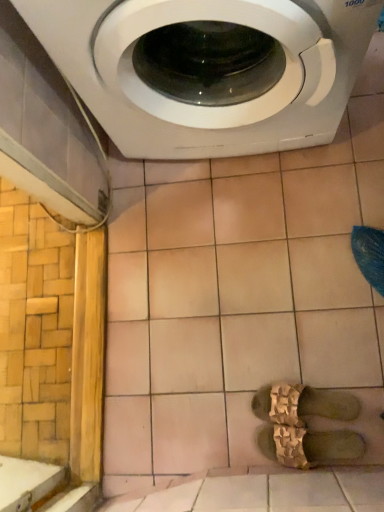
Describe the element at coordinates (236, 295) in the screenshot. This screenshot has height=512, width=384. I see `beige ceramic tile at upper center` at that location.

What do you see at coordinates (205, 71) in the screenshot? I see `white glossy washing machine at upper center` at bounding box center [205, 71].

Where is `brown textured sandals at center, acting as the first shoe starting from the bottom`? brown textured sandals at center, acting as the first shoe starting from the bottom is located at coordinates (308, 446).

Locate an element on the screen. The height and width of the screenshot is (512, 384). beige ceramic tile at upper center is located at coordinates (236, 295).

Considering the relative sizes of beige ceramic tile at upper center and white glossy washing machine at upper center in the image provided, is beige ceramic tile at upper center wider than white glossy washing machine at upper center?

Indeed, beige ceramic tile at upper center has a greater width compared to white glossy washing machine at upper center.

Image resolution: width=384 pixels, height=512 pixels. What are the coordinates of `ceramic tile located underneath the white glossy washing machine at upper center (from a real-world perspective)` in the screenshot? It's located at (236, 295).

Are beige ceramic tile at upper center and white glossy washing machine at upper center making contact?

beige ceramic tile at upper center and white glossy washing machine at upper center are not in contact.

Is beige ceramic tile at upper center located outside white glossy washing machine at upper center?

Indeed, beige ceramic tile at upper center is completely outside white glossy washing machine at upper center.

Can you confirm if gold textured sandals at center, the first shoe when ordered from top to bottom, is smaller than brown textured sandals at center, acting as the first shoe starting from the bottom?

Correct, gold textured sandals at center, the first shoe when ordered from top to bottom, occupies less space than brown textured sandals at center, acting as the first shoe starting from the bottom.

Where is `shoe located on the left of gold textured sandals at center, the first shoe when ordered from top to bottom`? shoe located on the left of gold textured sandals at center, the first shoe when ordered from top to bottom is located at coordinates (308, 446).

Considering the positions of objects gold textured sandals at center, the first shoe when ordered from top to bottom, and brown textured sandals at center, acting as the first shoe starting from the bottom, in the image provided, who is more to the right, gold textured sandals at center, the first shoe when ordered from top to bottom, or brown textured sandals at center, acting as the first shoe starting from the bottom,?

Positioned to the right is gold textured sandals at center, the first shoe when ordered from top to bottom.

Starting from the white glossy washing machine at upper center, which shoe is the 1st one to the right? Please provide its 2D coordinates.

[(308, 446)]

Does white glossy washing machine at upper center appear on the left side of brown textured sandals at center, which is the 2th shoe in top-to-bottom order?

Correct, you'll find white glossy washing machine at upper center to the left of brown textured sandals at center, which is the 2th shoe in top-to-bottom order.

Is white glossy washing machine at upper center far away from brown textured sandals at center, which is the 2th shoe in top-to-bottom order?

white glossy washing machine at upper center is near brown textured sandals at center, which is the 2th shoe in top-to-bottom order, not far away.

Does point (361, 51) appear closer or farther from the camera than point (332, 450)?

Point (361, 51).

Is brown textured sandals at center, which is the 2th shoe in top-to-bottom order, completely or partially inside beige ceramic tile at upper center?

No.

Which shoe is the 1st one when counting from the right side of the beige ceramic tile at upper center? Please provide its 2D coordinates.

[(308, 446)]

Relative to brown textured sandals at center, which is the 2th shoe in top-to-bottom order, is beige ceramic tile at upper center in front or behind?

beige ceramic tile at upper center is behind brown textured sandals at center, which is the 2th shoe in top-to-bottom order.

Is white glossy washing machine at upper center oriented towards gold textured sandals at center, which appears as the 2th shoe when ordered from the bottom?

Yes, white glossy washing machine at upper center is facing gold textured sandals at center, which appears as the 2th shoe when ordered from the bottom.

Considering the positions of points (293, 62) and (291, 403), is point (293, 62) closer to camera compared to point (291, 403)?

Yes, it is.

Between white glossy washing machine at upper center and gold textured sandals at center, the first shoe when ordered from top to bottom, which one is positioned behind?

Positioned behind is gold textured sandals at center, the first shoe when ordered from top to bottom.

Is white glossy washing machine at upper center at the right side of gold textured sandals at center, the first shoe when ordered from top to bottom?

In fact, white glossy washing machine at upper center is to the left of gold textured sandals at center, the first shoe when ordered from top to bottom.

Can we say brown textured sandals at center, which is the 2th shoe in top-to-bottom order, lies outside white glossy washing machine at upper center?

Yes, brown textured sandals at center, which is the 2th shoe in top-to-bottom order, is outside of white glossy washing machine at upper center.

Is brown textured sandals at center, acting as the first shoe starting from the bottom, wider than white glossy washing machine at upper center?

Incorrect, the width of brown textured sandals at center, acting as the first shoe starting from the bottom, does not surpass that of white glossy washing machine at upper center.

Is brown textured sandals at center, acting as the first shoe starting from the bottom, far from white glossy washing machine at upper center?

No, brown textured sandals at center, acting as the first shoe starting from the bottom, is not far from white glossy washing machine at upper center.

From a real-world perspective, which is physically below, brown textured sandals at center, acting as the first shoe starting from the bottom, or white glossy washing machine at upper center?

brown textured sandals at center, acting as the first shoe starting from the bottom.

Is white glossy washing machine at upper center positioned with its back to beige ceramic tile at upper center?

No, white glossy washing machine at upper center is not facing the opposite direction of beige ceramic tile at upper center.

The image size is (384, 512). What are the coordinates of `washing machine that appears above the beige ceramic tile at upper center (from a real-world perspective)` in the screenshot? It's located at (205, 71).

Is point (162, 86) behind point (348, 241)?

That is False.

What are the coordinates of `ceramic tile that is on the right side of white glossy washing machine at upper center` in the screenshot? It's located at (236, 295).

This screenshot has width=384, height=512. Identify the location of shoe in front of the gold textured sandals at center, the first shoe when ordered from top to bottom. (308, 446).

Based on their spatial positions, is beige ceramic tile at upper center or gold textured sandals at center, the first shoe when ordered from top to bottom, closer to brown textured sandals at center, acting as the first shoe starting from the bottom?

gold textured sandals at center, the first shoe when ordered from top to bottom.

Which object lies further to the anchor point white glossy washing machine at upper center, beige ceramic tile at upper center or brown textured sandals at center, acting as the first shoe starting from the bottom?

brown textured sandals at center, acting as the first shoe starting from the bottom.

Looking at the image, which one is located closer to white glossy washing machine at upper center, gold textured sandals at center, which appears as the 2th shoe when ordered from the bottom, or beige ceramic tile at upper center?

The object closer to white glossy washing machine at upper center is beige ceramic tile at upper center.

Looking at this image, when comparing their distances from beige ceramic tile at upper center, does white glossy washing machine at upper center or brown textured sandals at center, acting as the first shoe starting from the bottom, seem closer?

brown textured sandals at center, acting as the first shoe starting from the bottom, is closer to beige ceramic tile at upper center.

Estimate the real-world distances between objects in this image. Which object is further from beige ceramic tile at upper center, gold textured sandals at center, which appears as the 2th shoe when ordered from the bottom, or white glossy washing machine at upper center?

Among the two, white glossy washing machine at upper center is located further to beige ceramic tile at upper center.

Looking at the image, which one is located further to white glossy washing machine at upper center, brown textured sandals at center, which is the 2th shoe in top-to-bottom order, or gold textured sandals at center, the first shoe when ordered from top to bottom?

brown textured sandals at center, which is the 2th shoe in top-to-bottom order, lies further to white glossy washing machine at upper center than the other object.

Based on their spatial positions, is white glossy washing machine at upper center or beige ceramic tile at upper center closer to gold textured sandals at center, the first shoe when ordered from top to bottom?

beige ceramic tile at upper center.

When comparing their distances from beige ceramic tile at upper center, does brown textured sandals at center, which is the 2th shoe in top-to-bottom order, or gold textured sandals at center, which appears as the 2th shoe when ordered from the bottom, seem further?

brown textured sandals at center, which is the 2th shoe in top-to-bottom order, is positioned further to the anchor beige ceramic tile at upper center.

You are a GUI agent. You are given a task and a screenshot of the screen. Output one action in this format:
    pyautogui.click(x=<x>, y=<y>)
    Task: Click on the ceramic tile that lies between white glossy washing machine at upper center and gold textured sandals at center, which appears as the 2th shoe when ordered from the bottom, from top to bottom
    The width and height of the screenshot is (384, 512).
    Given the screenshot: What is the action you would take?
    pyautogui.click(x=236, y=295)

Where is `shoe between white glossy washing machine at upper center and brown textured sandals at center, acting as the first shoe starting from the bottom, from top to bottom`? The image size is (384, 512). shoe between white glossy washing machine at upper center and brown textured sandals at center, acting as the first shoe starting from the bottom, from top to bottom is located at coordinates (304, 403).

The image size is (384, 512). I want to click on shoe between beige ceramic tile at upper center and brown textured sandals at center, acting as the first shoe starting from the bottom, in the up-down direction, so click(304, 403).

At what (x,y) coordinates should I click in order to perform the action: click on ceramic tile between white glossy washing machine at upper center and brown textured sandals at center, acting as the first shoe starting from the bottom, in the up-down direction. Please return your answer as a coordinate pair (x, y). This screenshot has height=512, width=384. Looking at the image, I should click on (236, 295).